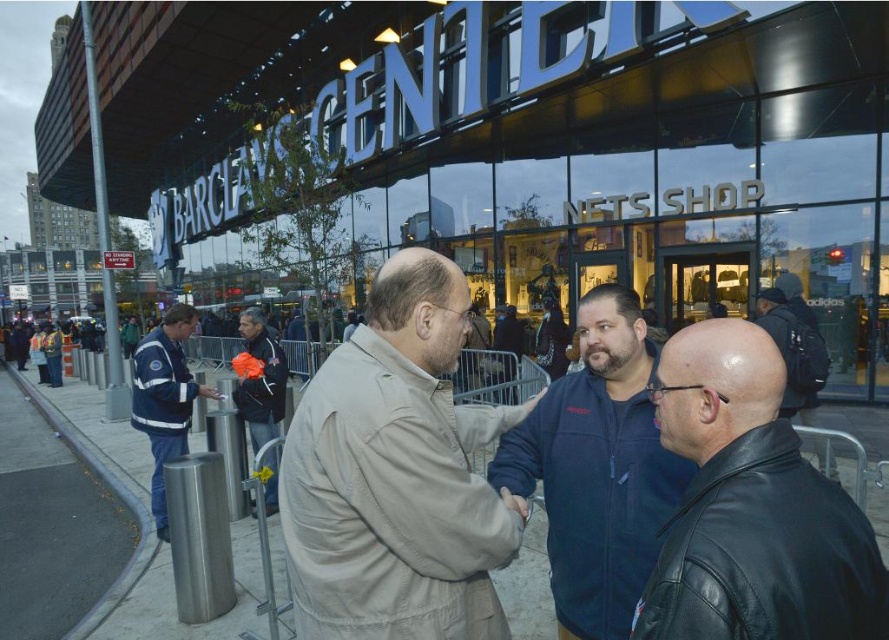
Does point (431, 576) come closer to viewer compared to point (134, 396)?

Yes, it is.

Locate an element on the screen. beige fabric jacket at center is located at coordinates (396, 474).

Where is `beige fabric jacket at center`? beige fabric jacket at center is located at coordinates point(396,474).

Is blue reflective jacket at left smaller than orange fleece jacket at center?

Actually, blue reflective jacket at left might be larger than orange fleece jacket at center.

Is blue reflective jacket at left bigger than orange fleece jacket at center?

Correct, blue reflective jacket at left is larger in size than orange fleece jacket at center.

You are a GUI agent. You are given a task and a screenshot of the screen. Output one action in this format:
    pyautogui.click(x=<x>, y=<y>)
    Task: Click on the blue reflective jacket at left
    Image resolution: width=889 pixels, height=640 pixels.
    Given the screenshot: What is the action you would take?
    pyautogui.click(x=164, y=397)

The image size is (889, 640). I want to click on blue reflective jacket at left, so click(x=164, y=397).

Which is more to the left, beige fabric jacket at center or orange fleece jacket at center?

orange fleece jacket at center

Is beige fabric jacket at center above orange fleece jacket at center?

Correct, beige fabric jacket at center is located above orange fleece jacket at center.

The image size is (889, 640). What do you see at coordinates (396, 474) in the screenshot? I see `beige fabric jacket at center` at bounding box center [396, 474].

This screenshot has height=640, width=889. I want to click on beige fabric jacket at center, so click(396, 474).